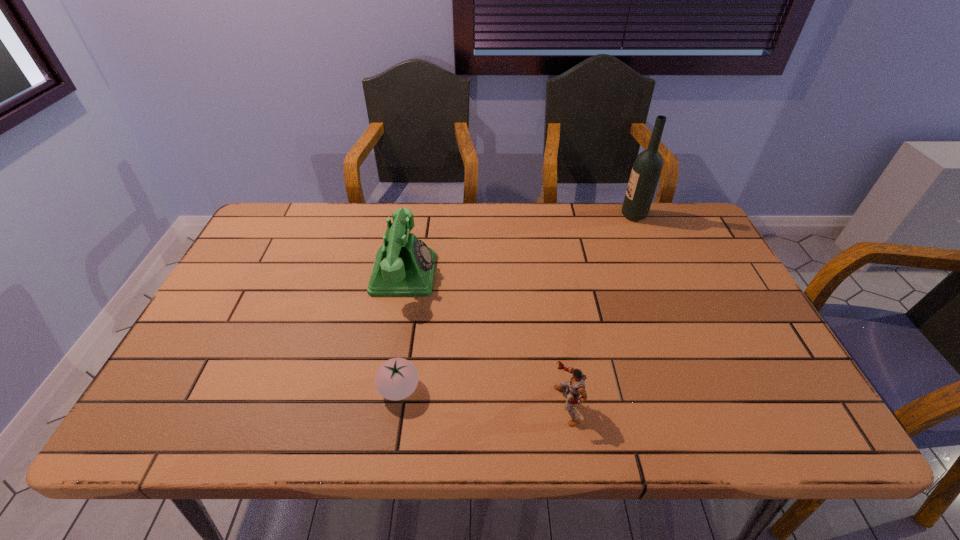
Where is `object located in the far right corner section of the desktop`? This screenshot has height=540, width=960. object located in the far right corner section of the desktop is located at coordinates (646, 171).

The width and height of the screenshot is (960, 540). In order to click on vacant space at the far edge of the desktop in this screenshot , I will do 339,220.

The width and height of the screenshot is (960, 540). Find the location of `vacant area at the near edge of the desktop`. vacant area at the near edge of the desktop is located at coordinates (718, 430).

You are a GUI agent. You are given a task and a screenshot of the screen. Output one action in this format:
    pyautogui.click(x=<x>, y=<y>)
    Task: Click on the vacant area at the left edge
    This screenshot has width=960, height=540.
    Given the screenshot: What is the action you would take?
    pyautogui.click(x=198, y=350)

Identify the location of vacant space at the right edge of the desktop. Image resolution: width=960 pixels, height=540 pixels. (728, 398).

You are a GUI agent. You are given a task and a screenshot of the screen. Output one action in this format:
    pyautogui.click(x=<x>, y=<y>)
    Task: Click on the blank space at the far left corner of the desktop
    
    Given the screenshot: What is the action you would take?
    pyautogui.click(x=274, y=239)

Image resolution: width=960 pixels, height=540 pixels. I want to click on vacant region at the far right corner of the desktop, so click(685, 202).

Where is `vacant area that lies between the telephone and the tallest object`? vacant area that lies between the telephone and the tallest object is located at coordinates (518, 245).

The width and height of the screenshot is (960, 540). Identify the location of free space between the telephone and the rightmost object. (518, 245).

Find the location of a particular element. empty location between the telephone and the second object from right to left is located at coordinates (485, 340).